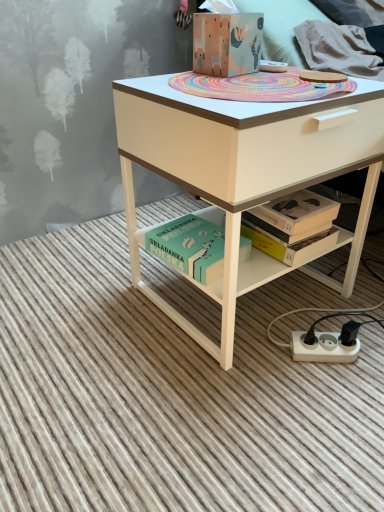
Question: In the image, is matte white desk at center positioned in front of or behind white plastic power plugs and sockets at lower right?

Choices:
 (A) behind
 (B) front

Answer: (B)

Question: From the image's perspective, is matte white desk at center positioned above or below white plastic power plugs and sockets at lower right?

Choices:
 (A) below
 (B) above

Answer: (B)

Question: Which of these objects is positioned farthest from the white plastic power plugs and sockets at lower right?

Choices:
 (A) matte white desk at center
 (B) wooden painted box at center
 (C) green matte book at lower center

Answer: (B)

Question: Which object is positioned farthest from the white plastic power plugs and sockets at lower right?

Choices:
 (A) green matte book at lower center
 (B) wooden painted box at center
 (C) matte white desk at center

Answer: (B)